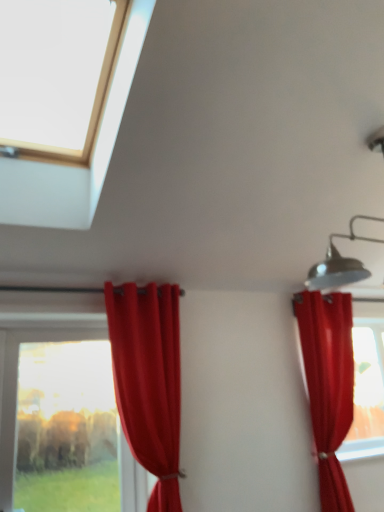
What is the approximate width of transparent glass window at upper left, the 2th window when ordered from bottom to top?

It is 34.52 inches.

This screenshot has width=384, height=512. What do you see at coordinates (75, 167) in the screenshot?
I see `transparent glass window at upper left, the 2th window when ordered from bottom to top` at bounding box center [75, 167].

What is the approximate height of transparent glass window at lower left, which is the 2th window from top to bottom?

transparent glass window at lower left, which is the 2th window from top to bottom, is 1.11 meters tall.

Where is `transparent glass window at upper left, which is the 2th window from back to front`? transparent glass window at upper left, which is the 2th window from back to front is located at coordinates (75, 167).

From a real-world perspective, is satin red curtain at right, the second curtain when ordered from left to right, located higher than velvet red curtain at left, which appears as the 2th curtain when viewed from the right?

No.

Considering the sizes of objects satin red curtain at right, the second curtain when ordered from left to right, and velvet red curtain at left, which appears as the 2th curtain when viewed from the right, in the image provided, who is bigger, satin red curtain at right, the second curtain when ordered from left to right, or velvet red curtain at left, which appears as the 2th curtain when viewed from the right,?

velvet red curtain at left, which appears as the 2th curtain when viewed from the right, is bigger.

Between satin red curtain at right, the second curtain when ordered from left to right, and velvet red curtain at left, acting as the 1th curtain starting from the left, which one has smaller width?

With smaller width is satin red curtain at right, the second curtain when ordered from left to right.

From a real-world perspective, is transparent glass window at lower left, the 1th window from the bottom, physically located above or below velvet red curtain at left, acting as the 1th curtain starting from the left?

In terms of real-world spatial position, transparent glass window at lower left, the 1th window from the bottom, is below velvet red curtain at left, acting as the 1th curtain starting from the left.

Does point (26, 442) lie behind point (133, 440)?

Yes, it is.

Is transparent glass window at lower left, the 1th window from the bottom, inside the boundaries of velvet red curtain at left, acting as the 1th curtain starting from the left, or outside?

transparent glass window at lower left, the 1th window from the bottom, is outside velvet red curtain at left, acting as the 1th curtain starting from the left.

From the image's perspective, is transparent glass window at lower left, the 1th window from the bottom, located above velvet red curtain at left, acting as the 1th curtain starting from the left?

No, from the image's perspective, transparent glass window at lower left, the 1th window from the bottom, is not over velvet red curtain at left, acting as the 1th curtain starting from the left.

From the image's perspective, between transparent glass window at upper left, which is the 2th window from back to front, and transparent glass window at lower left, which is the 2th window from top to bottom, which one is located above?

From the image's view, transparent glass window at upper left, which is the 2th window from back to front, is above.

Image resolution: width=384 pixels, height=512 pixels. I want to click on window on the right of transparent glass window at lower left, placed as the first window when sorted from back to front, so click(75, 167).

Can you see transparent glass window at upper left, which appears as the first window when viewed from the top, touching transparent glass window at lower left, marked as the 2th window in a front-to-back arrangement?

No, transparent glass window at upper left, which appears as the first window when viewed from the top, is not touching transparent glass window at lower left, marked as the 2th window in a front-to-back arrangement.

Is transparent glass window at upper left, arranged as the 1th window when viewed from the front, positioned beyond the bounds of transparent glass window at lower left, the 1th window from the bottom?

transparent glass window at upper left, arranged as the 1th window when viewed from the front, lies outside transparent glass window at lower left, the 1th window from the bottom,'s area.

Considering the relative sizes of velvet red curtain at left, acting as the 1th curtain starting from the left, and transparent glass window at lower left, the 1th window from the bottom, in the image provided, is velvet red curtain at left, acting as the 1th curtain starting from the left, bigger than transparent glass window at lower left, the 1th window from the bottom,?

Indeed, velvet red curtain at left, acting as the 1th curtain starting from the left, has a larger size compared to transparent glass window at lower left, the 1th window from the bottom.

Considering the relative positions of velvet red curtain at left, which appears as the 2th curtain when viewed from the right, and transparent glass window at lower left, marked as the 2th window in a front-to-back arrangement, in the image provided, is velvet red curtain at left, which appears as the 2th curtain when viewed from the right, to the right of transparent glass window at lower left, marked as the 2th window in a front-to-back arrangement, from the viewer's perspective?

Yes, velvet red curtain at left, which appears as the 2th curtain when viewed from the right, is to the right of transparent glass window at lower left, marked as the 2th window in a front-to-back arrangement.

From the image's perspective, is velvet red curtain at left, acting as the 1th curtain starting from the left, under transparent glass window at lower left, the 1th window from the bottom?

No.

From their relative heights in the image, would you say velvet red curtain at left, acting as the 1th curtain starting from the left, is taller or shorter than transparent glass window at lower left, marked as the 2th window in a front-to-back arrangement?

velvet red curtain at left, acting as the 1th curtain starting from the left, is taller than transparent glass window at lower left, marked as the 2th window in a front-to-back arrangement.

Between point (168, 483) and point (321, 488), which one is positioned in front?

Positioned in front is point (168, 483).

Who is shorter, velvet red curtain at left, which appears as the 2th curtain when viewed from the right, or satin red curtain at right, which appears as the first curtain when viewed from the right?

With less height is velvet red curtain at left, which appears as the 2th curtain when viewed from the right.

Which of these two, velvet red curtain at left, acting as the 1th curtain starting from the left, or satin red curtain at right, which appears as the first curtain when viewed from the right, is wider?

Wider between the two is velvet red curtain at left, acting as the 1th curtain starting from the left.

Which is more to the right, transparent glass window at upper left, which appears as the first window when viewed from the top, or satin red curtain at right, which appears as the first curtain when viewed from the right?

satin red curtain at right, which appears as the first curtain when viewed from the right, is more to the right.

Which curtain is the 2nd one when counting from the right side of the transparent glass window at upper left, which is the 2th window from back to front? Please provide its 2D coordinates.

[(328, 385)]

From a real-world perspective, does transparent glass window at upper left, which appears as the first window when viewed from the top, stand above satin red curtain at right, the second curtain when ordered from left to right?

Correct, in the physical world, transparent glass window at upper left, which appears as the first window when viewed from the top, is higher than satin red curtain at right, the second curtain when ordered from left to right.

Considering the positions of points (139, 4) and (311, 292), is point (139, 4) farther from camera compared to point (311, 292)?

That is False.

From a real-world perspective, is satin red curtain at right, which appears as the first curtain when viewed from the right, positioned under transparent glass window at lower left, marked as the 2th window in a front-to-back arrangement, based on gravity?

No, from a real-world perspective, satin red curtain at right, which appears as the first curtain when viewed from the right, is not under transparent glass window at lower left, marked as the 2th window in a front-to-back arrangement.

Considering their positions, is satin red curtain at right, the second curtain when ordered from left to right, located in front of or behind transparent glass window at lower left, placed as the first window when sorted from back to front?

Clearly, satin red curtain at right, the second curtain when ordered from left to right, is behind transparent glass window at lower left, placed as the first window when sorted from back to front.

Is satin red curtain at right, the second curtain when ordered from left to right, looking in the opposite direction of transparent glass window at lower left, the 1th window from the bottom?

No, satin red curtain at right, the second curtain when ordered from left to right, is not facing away from transparent glass window at lower left, the 1th window from the bottom.

Locate an element on the screen. The height and width of the screenshot is (512, 384). curtain below the velvet red curtain at left, which appears as the 2th curtain when viewed from the right (from the image's perspective) is located at coordinates (328, 385).

From a real-world perspective, which curtain is the 2nd one above the transparent glass window at lower left, placed as the first window when sorted from back to front? Please provide its 2D coordinates.

[(148, 381)]

Considering their positions, is transparent glass window at upper left, the 2th window when ordered from bottom to top, positioned closer to velvet red curtain at left, which appears as the 2th curtain when viewed from the right, than satin red curtain at right, the second curtain when ordered from left to right?

transparent glass window at upper left, the 2th window when ordered from bottom to top.

Based on the photo, when comparing their distances from velvet red curtain at left, acting as the 1th curtain starting from the left, does transparent glass window at lower left, the 1th window from the bottom, or satin red curtain at right, which appears as the first curtain when viewed from the right, seem closer?

satin red curtain at right, which appears as the first curtain when viewed from the right, is positioned closer to the anchor velvet red curtain at left, acting as the 1th curtain starting from the left.

Considering their positions, is transparent glass window at lower left, placed as the first window when sorted from back to front, positioned closer to velvet red curtain at left, acting as the 1th curtain starting from the left, than transparent glass window at upper left, arranged as the 1th window when viewed from the front?

transparent glass window at upper left, arranged as the 1th window when viewed from the front, is closer to velvet red curtain at left, acting as the 1th curtain starting from the left.

Looking at the image, which one is located closer to transparent glass window at upper left, the 2th window when ordered from bottom to top, satin red curtain at right, the second curtain when ordered from left to right, or transparent glass window at lower left, which is the 2th window from top to bottom?

Based on the image, satin red curtain at right, the second curtain when ordered from left to right, appears to be nearer to transparent glass window at upper left, the 2th window when ordered from bottom to top.

Considering their positions, is transparent glass window at upper left, which is the 2th window from back to front, positioned further to transparent glass window at lower left, the 1th window from the bottom, than satin red curtain at right, the second curtain when ordered from left to right?

transparent glass window at upper left, which is the 2th window from back to front.

Based on their spatial positions, is transparent glass window at lower left, marked as the 2th window in a front-to-back arrangement, or satin red curtain at right, the second curtain when ordered from left to right, closer to transparent glass window at upper left, the 2th window when ordered from bottom to top?

satin red curtain at right, the second curtain when ordered from left to right, lies closer to transparent glass window at upper left, the 2th window when ordered from bottom to top, than the other object.

Based on their spatial positions, is satin red curtain at right, the second curtain when ordered from left to right, or transparent glass window at upper left, the 2th window when ordered from bottom to top, further from velvet red curtain at left, which appears as the 2th curtain when viewed from the right?

Based on the image, satin red curtain at right, the second curtain when ordered from left to right, appears to be further to velvet red curtain at left, which appears as the 2th curtain when viewed from the right.

From the picture: From the image, which object appears to be nearer to velvet red curtain at left, which appears as the 2th curtain when viewed from the right, satin red curtain at right, the second curtain when ordered from left to right, or transparent glass window at lower left, the 1th window from the bottom?

Among the two, satin red curtain at right, the second curtain when ordered from left to right, is located nearer to velvet red curtain at left, which appears as the 2th curtain when viewed from the right.

Where is `curtain between transparent glass window at lower left, the 1th window from the bottom, and satin red curtain at right, which appears as the first curtain when viewed from the right, from left to right`? The image size is (384, 512). curtain between transparent glass window at lower left, the 1th window from the bottom, and satin red curtain at right, which appears as the first curtain when viewed from the right, from left to right is located at coordinates (148, 381).

The height and width of the screenshot is (512, 384). Identify the location of curtain between transparent glass window at upper left, which appears as the first window when viewed from the top, and satin red curtain at right, which appears as the first curtain when viewed from the right, from top to bottom. (148, 381).